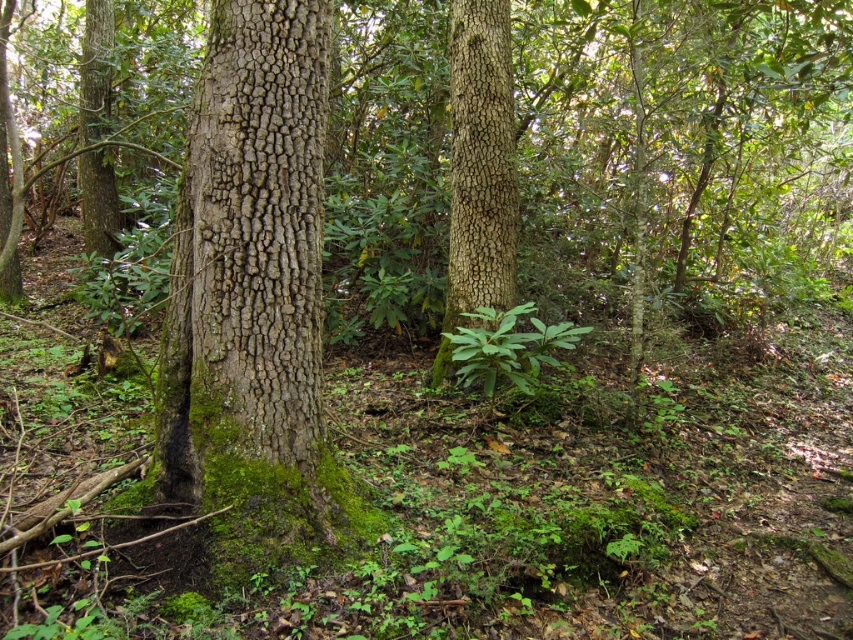
Does green mossy bark tree trunk at center have a lesser height compared to smooth brown bark at center?

Yes.

Does point (306, 472) come farther from viewer compared to point (442, 344)?

No, (306, 472) is in front of (442, 344).

Locate an element on the screen. The width and height of the screenshot is (853, 640). green mossy bark tree trunk at center is located at coordinates (252, 294).